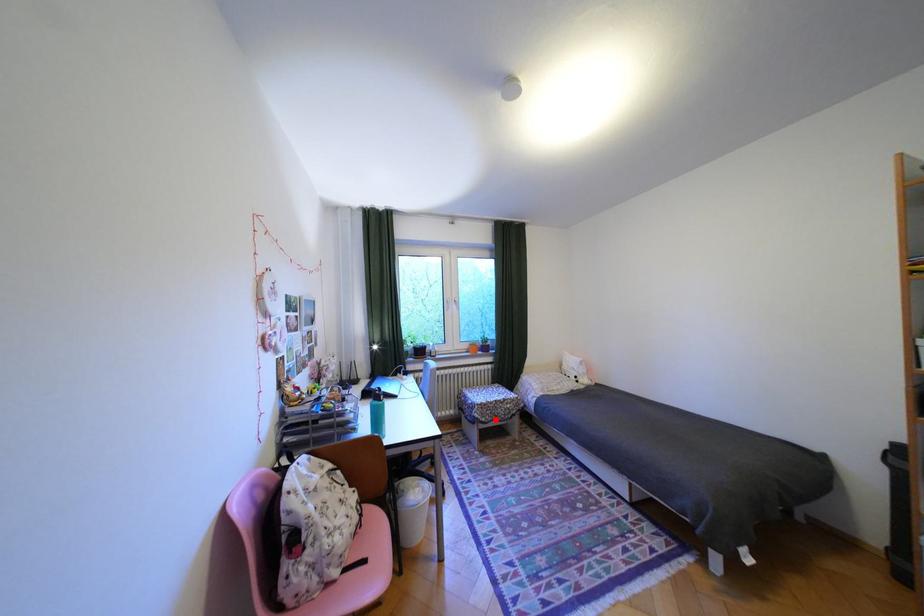
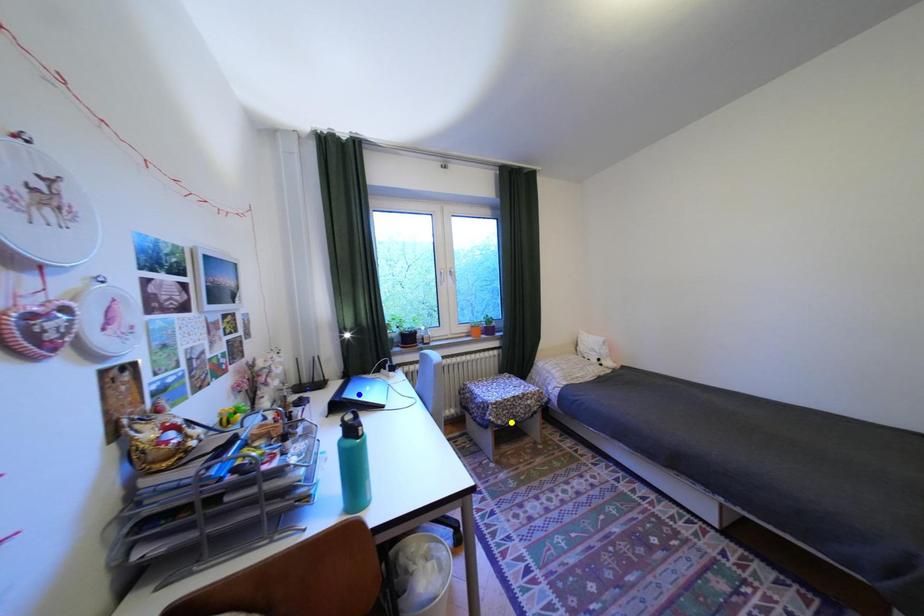
Question: I am providing you with two images of the same scene from different viewpoints. A red point is marked on the first image. You are given multiple points on the second image. Which spot in image 2 lines up with the point in image 1?

Choices:
 (A) green point
 (B) blue point
 (C) yellow point

Answer: (C)